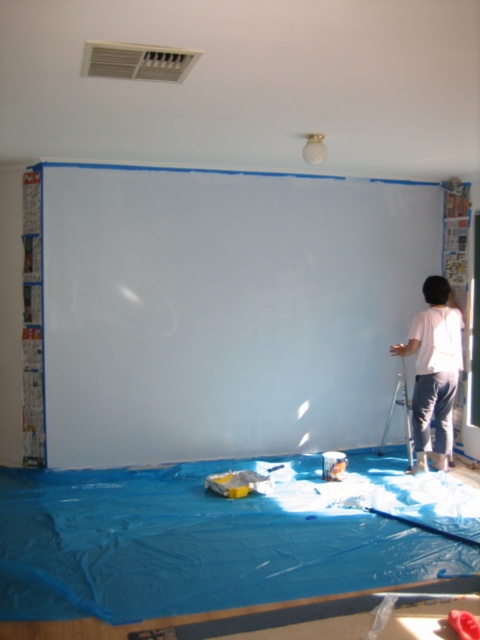
Question: Which point is closer to the camera taking this photo?

Choices:
 (A) (96, 346)
 (B) (456, 356)
 (C) (384, 436)

Answer: (B)

Question: Can you confirm if white matte wall at center is wider than metallic silver ladder at right?

Choices:
 (A) yes
 (B) no

Answer: (A)

Question: Among these points, which one is nearest to the camera?

Choices:
 (A) (405, 372)
 (B) (453, 305)

Answer: (B)

Question: Considering the real-world distances, which object is farthest from the metallic silver ladder at right?

Choices:
 (A) white cotton shirt at right
 (B) white matte wall at center

Answer: (B)

Question: Does white cotton shirt at right appear on the left side of metallic silver ladder at right?

Choices:
 (A) yes
 (B) no

Answer: (B)

Question: Does white matte wall at center appear on the right side of metallic silver ladder at right?

Choices:
 (A) no
 (B) yes

Answer: (A)